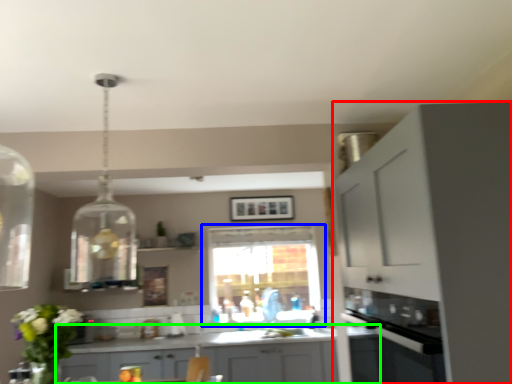
Question: Which object is positioned farthest from cabinetry (highlighted by a red box)? Select from window (highlighted by a blue box) and cabinetry (highlighted by a green box).

Choices:
 (A) window
 (B) cabinetry

Answer: (A)